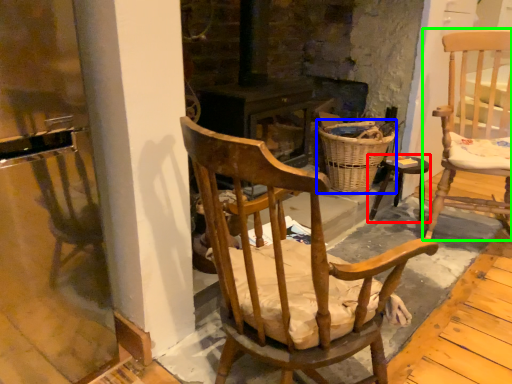
Question: Which object is the closest to the stool (highlighted by a red box)? Choose among these: basket (highlighted by a blue box) or chair (highlighted by a green box).

Choices:
 (A) basket
 (B) chair

Answer: (A)